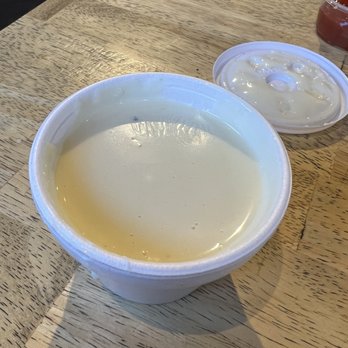
The image size is (348, 348). I want to click on bright spot on table, so click(x=130, y=61).